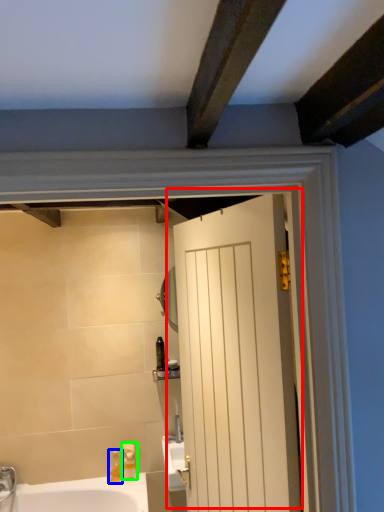
Question: Which is nearer to the door (highlighted by a red box)? soap dispenser (highlighted by a blue box) or soap dispenser (highlighted by a green box).

Choices:
 (A) soap dispenser
 (B) soap dispenser

Answer: (B)